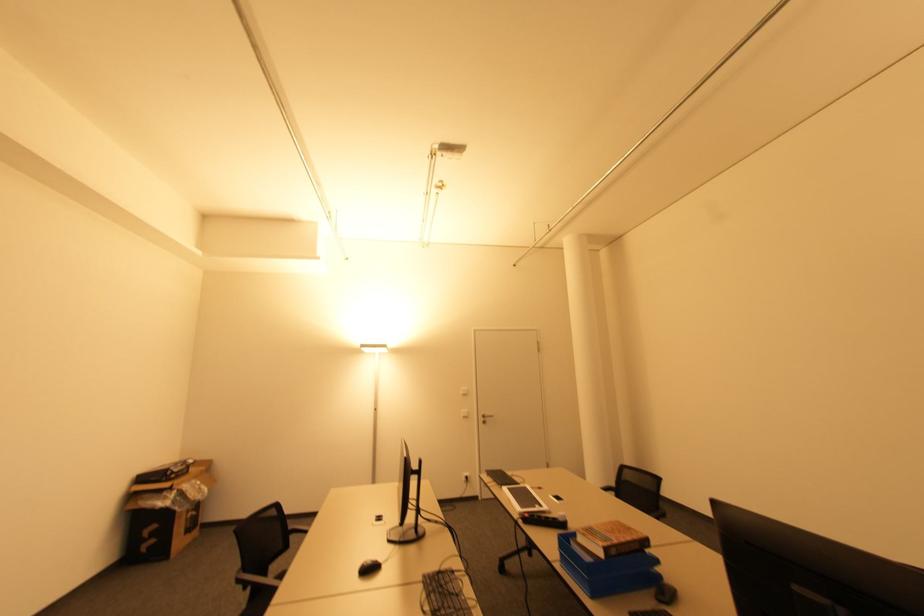
Locate an element on the screen. black chair armrest is located at coordinates (258, 580).